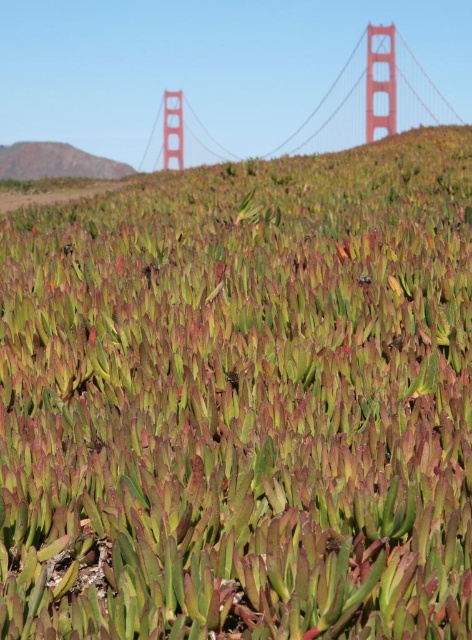
Based on the scene description, if you were to compare the sizes of the red painted steel golden gate bridge at upper center and the green grassy hillside at upper left, which one appears bigger in the image?

The red painted steel golden gate bridge at upper center appears larger in the image compared to the green grassy hillside at upper left as stated in the objects description.

You are a photographer planning to capture a wide shot of the red painted steel golden gate bridge at upper center and the green grassy hillside at upper left. Based on their sizes in the image, which object would require a wider angle lens to fully capture in your photo?

The red painted steel golden gate bridge at upper center has a greater width than the green grassy hillside at upper left, so it would require a wider angle lens to fully capture in the photo.

You are a drone operator trying to capture the Golden Gate Bridge in the background of your photo. You have a camera with a fixed focus set on the point at point (x=370, y=99). Will this focus point capture the red painted steel golden gate bridge at upper center clearly?

The red painted steel golden gate bridge at upper center is represented by point (x=370, y=99), so yes, the focus point at point (x=370, y=99) will capture the red painted steel golden gate bridge at upper center clearly.